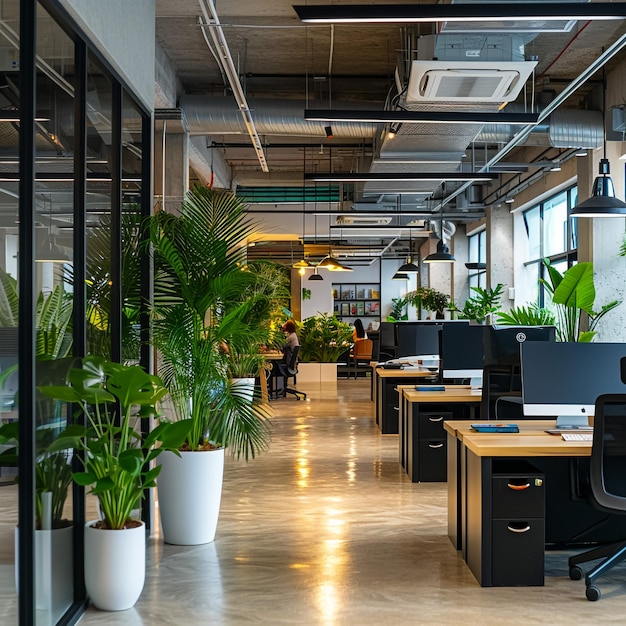
At what (x,y) coordinates should I click in order to perform the action: click on reflection of light coming into office room. Please return your answer as a coordinate pair (x, y). The image size is (626, 626). Looking at the image, I should click on (332, 501).